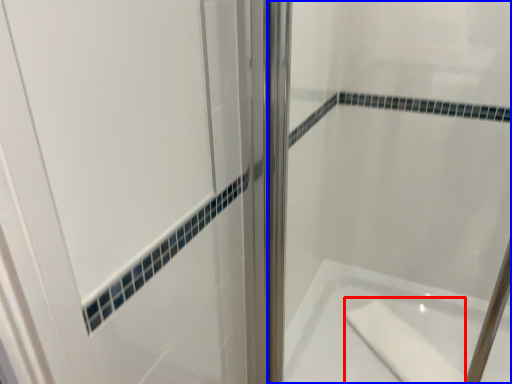
Question: Which object appears farthest to the camera in this image, soap (highlighted by a red box) or shower door (highlighted by a blue box)?

Choices:
 (A) soap
 (B) shower door

Answer: (A)